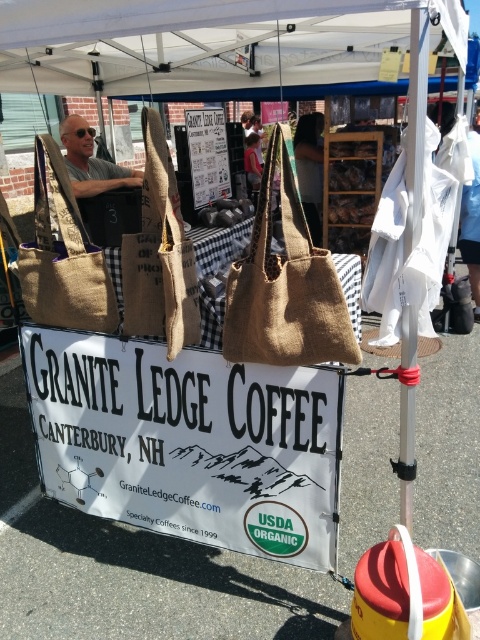
Can you confirm if white paper sign at center is positioned below burlap tote bag at center?

Yes, white paper sign at center is below burlap tote bag at center.

Can you confirm if white paper sign at center is shorter than burlap tote bag at center?

Incorrect, white paper sign at center's height does not fall short of burlap tote bag at center's.

Which is in front, point (307, 497) or point (247, 317)?

Positioned in front is point (247, 317).

Where is `white paper sign at center`? The width and height of the screenshot is (480, 640). white paper sign at center is located at coordinates (189, 442).

Is burlap tote bag at center closer to camera compared to burlap tote at left?

That is True.

Is point (256, 346) more distant than point (67, 221)?

No, it is in front of (67, 221).

Which is in front, point (332, 332) or point (98, 330)?

Point (332, 332)

At what (x,y) coordinates should I click in order to perform the action: click on burlap tote bag at center. Please return your answer as a coordinate pair (x, y). Looking at the image, I should click on (285, 285).

Does burlap tote bag at center appear on the left side of matte gray hair at upper left?

No, burlap tote bag at center is not to the left of matte gray hair at upper left.

Between point (284, 180) and point (70, 173), which one is positioned in front?

Point (284, 180)

This screenshot has width=480, height=640. What are the coordinates of `burlap tote bag at center` in the screenshot? It's located at (285, 285).